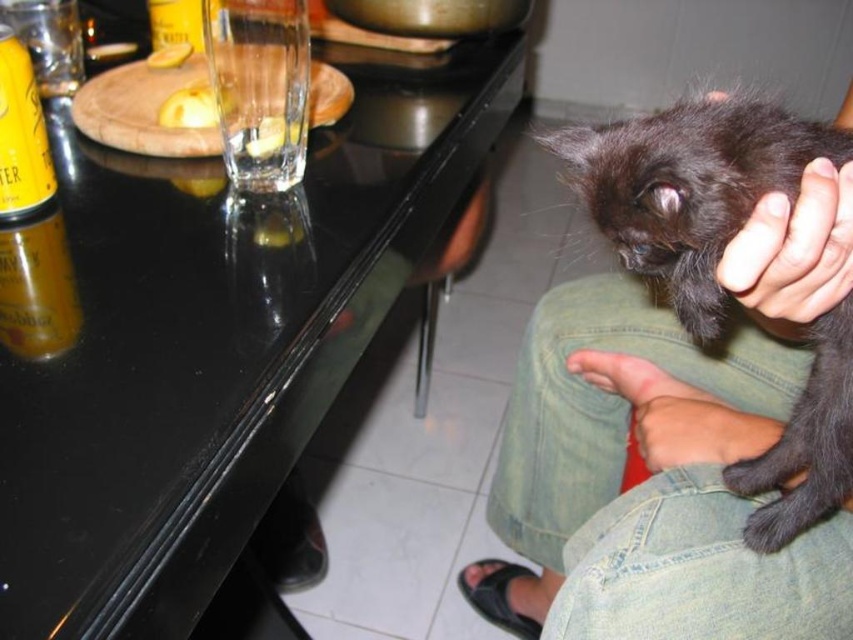
Who is higher up, black matte hand at upper right or smooth skin hand at lower right?

black matte hand at upper right is higher up.

Can you confirm if black matte hand at upper right is positioned below smooth skin hand at lower right?

No, black matte hand at upper right is not below smooth skin hand at lower right.

Is point (735, 236) farther from viewer compared to point (665, 388)?

No, it is not.

Where is `black matte hand at upper right`? Image resolution: width=853 pixels, height=640 pixels. black matte hand at upper right is located at coordinates (793, 252).

How far apart are black furry cat at upper right and smooth skin hand at lower right?

A distance of 5.90 inches exists between black furry cat at upper right and smooth skin hand at lower right.

Is point (807, 198) less distant than point (708, 420)?

Yes, point (807, 198) is closer to viewer.

Image resolution: width=853 pixels, height=640 pixels. What are the coordinates of `black furry cat at upper right` in the screenshot? It's located at (669, 449).

Can you confirm if black fluffy cat at upper right is positioned below smooth skin hand at lower right?

No, black fluffy cat at upper right is not below smooth skin hand at lower right.

Who is shorter, black fluffy cat at upper right or smooth skin hand at lower right?

smooth skin hand at lower right is shorter.

Is point (822, 225) positioned before point (675, 451)?

Yes, it is.

Find the location of a particular element. black fluffy cat at upper right is located at coordinates [793, 252].